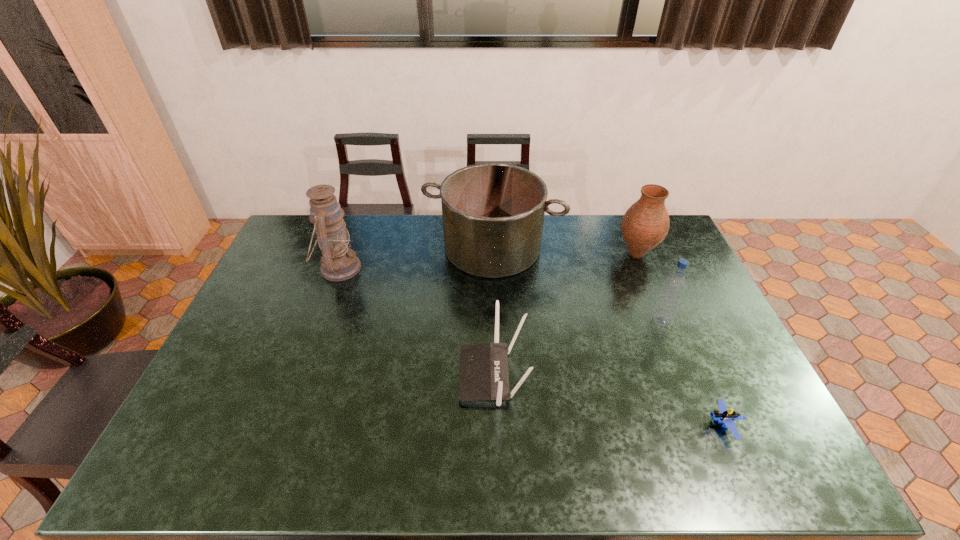
In order to click on the leftmost object in this screenshot , I will do `click(338, 262)`.

The image size is (960, 540). What are the coordinates of `oil lamp` in the screenshot? It's located at (338, 262).

What are the coordinates of `vase` in the screenshot? It's located at (646, 223).

Find the location of a particular element. pan is located at coordinates (493, 213).

Image resolution: width=960 pixels, height=540 pixels. I want to click on water bottle, so click(x=674, y=285).

Where is `router`? The height and width of the screenshot is (540, 960). router is located at coordinates (484, 375).

Find the location of a particular element. The height and width of the screenshot is (540, 960). Lego is located at coordinates (722, 415).

The height and width of the screenshot is (540, 960). Identify the location of free location located on the back of the oil lamp. (349, 238).

You are a GUI agent. You are given a task and a screenshot of the screen. Output one action in this format:
    pyautogui.click(x=<x>, y=<y>)
    Task: Click on the vacant region located on the front of the vase
    The height and width of the screenshot is (540, 960).
    Given the screenshot: What is the action you would take?
    pyautogui.click(x=660, y=312)

Where is `free space located 0.280m on the right of the pan`? This screenshot has height=540, width=960. free space located 0.280m on the right of the pan is located at coordinates (637, 248).